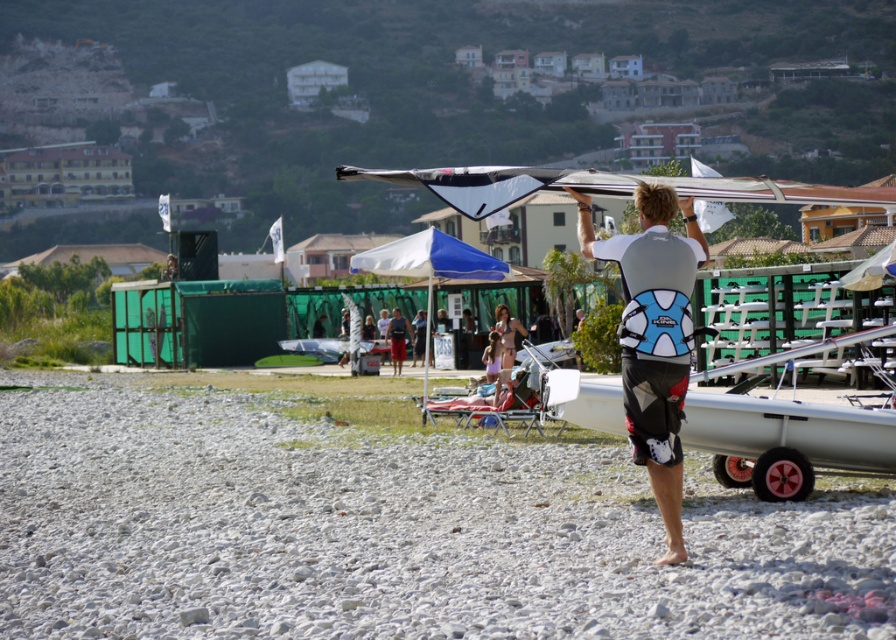
You are organizing a beach event and need to arrange two items on a display table. The items are the white matte wetsuit at center and the matte pink dress at center. Which item will require more space on the table?

The matte pink dress at center will require more space on the table because it occupies more space than the white matte wetsuit at center.